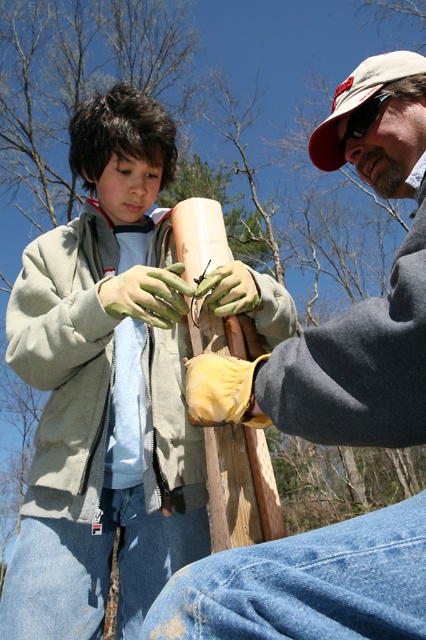
You are standing in the scene and want to reach both the point at [146,378] and the point at [291,397]. Which point will you reach first?

You will reach the point at [146,378] first because it is closer to you than the point at [291,397].

You are a photographer trying to capture the matte gray jacket at center and the white fabric baseball cap at upper right in the same frame. Which object should you focus on first to ensure both are in focus?

You should focus on the matte gray jacket at center first because it is closer to the viewer than the white fabric baseball cap at upper right, so adjusting focus from near to far will help both objects be in focus.

You are standing in the outdoor area shown in the image. You need to locate the matte gray jacket at center and the white fabric baseball cap at upper right. Which object is positioned more to the right side of the scene?

The white fabric baseball cap at upper right is positioned more to the right side of the scene compared to the matte gray jacket at center.